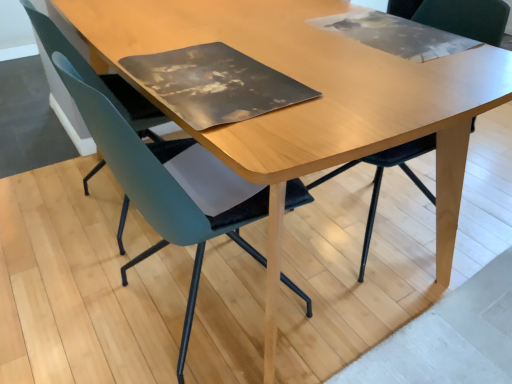
Question: Is teal matte chair at left, the 1th chair in the left-to-right sequence, wider or thinner than light wood table at center?

Choices:
 (A) wide
 (B) thin

Answer: (B)

Question: From the image's perspective, is teal matte chair at left, the third chair viewed from the right, above or below light wood table at center?

Choices:
 (A) above
 (B) below

Answer: (A)

Question: Estimate the real-world distances between objects in this image. Which object is closer to the matte black chair at center, the 3th chair in the left-to-right sequence?

Choices:
 (A) light wood table at center
 (B) teal matte chair at left, the third chair viewed from the right
 (C) teal fabric chair at center, the second chair in the left-to-right sequence

Answer: (A)

Question: Which is nearer to the teal fabric chair at center, arranged as the second chair when viewed from the right?

Choices:
 (A) teal matte chair at left, the 1th chair in the left-to-right sequence
 (B) matte black chair at center, the first chair positioned from the right
 (C) light wood table at center

Answer: (A)